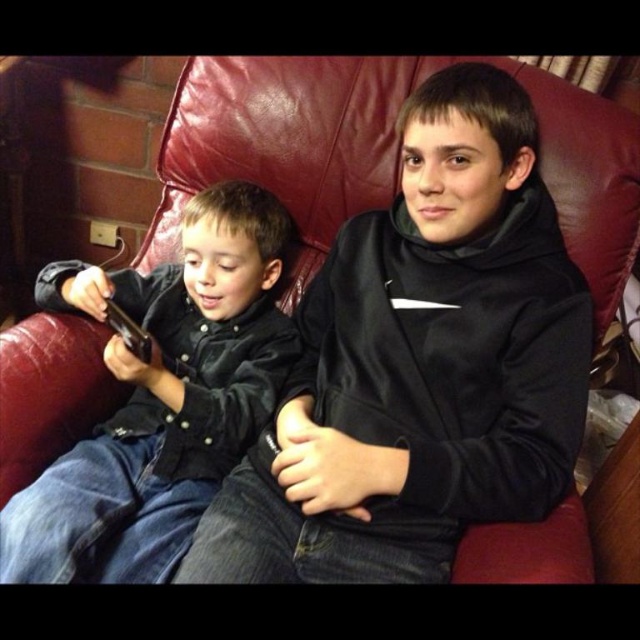
You are a delivery robot that needs to place a small package between the black matte hoodie at center and the matte black shirt at left. The package is 10 inches long. Can you fit it in the space between them?

The distance between the black matte hoodie at center and the matte black shirt at left is 9.24 inches. Since the package is 10 inches long, it won

You are a fashion designer analyzing the image. You need to determine which clothing item is taller between the black matte hoodie at center and the matte black shirt at left. Which one is taller?

The black matte hoodie at center is taller than the matte black shirt at left according to the description.

You are designing a new clothing catalog and need to know the relative sizes of the items. Given that you have a black matte hoodie at center and a matte black shirt at left, which one is wider?

The black matte hoodie at center is wider than the matte black shirt at left according to the description.